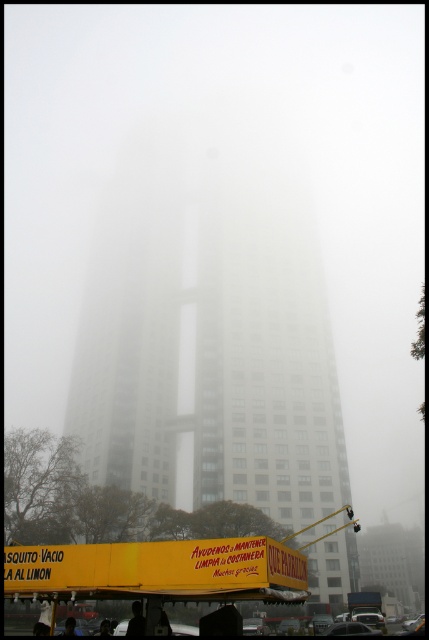
Is white glass tower at center shorter than yellow matte food truck at lower center?

No.

Can you confirm if white glass tower at center is taller than yellow matte food truck at lower center?

Yes, white glass tower at center is taller than yellow matte food truck at lower center.

This screenshot has height=640, width=429. What do you see at coordinates (210, 333) in the screenshot?
I see `white glass tower at center` at bounding box center [210, 333].

The image size is (429, 640). I want to click on white glass tower at center, so click(210, 333).